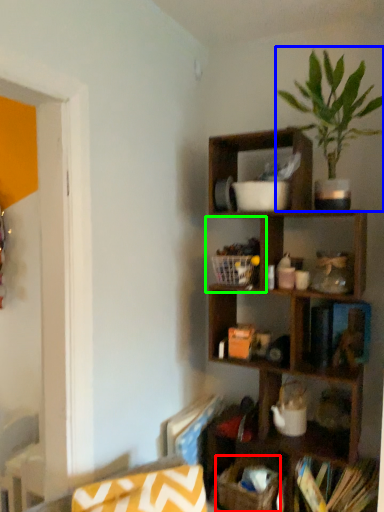
Question: Considering the real-world distances, which object is farthest from basket (highlighted by a red box)? houseplant (highlighted by a blue box) or cabinet (highlighted by a green box)?

Choices:
 (A) houseplant
 (B) cabinet

Answer: (A)